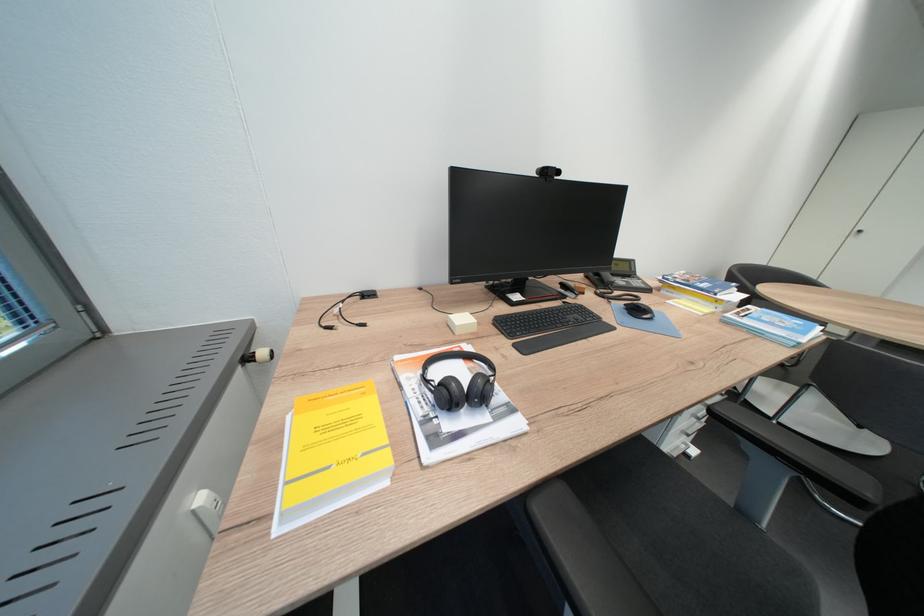
At what (x,y) coordinates should I click in order to perform the action: click on black webcam. Please return your answer as a coordinate pair (x, y). The image size is (924, 616). Looking at the image, I should click on (548, 172).